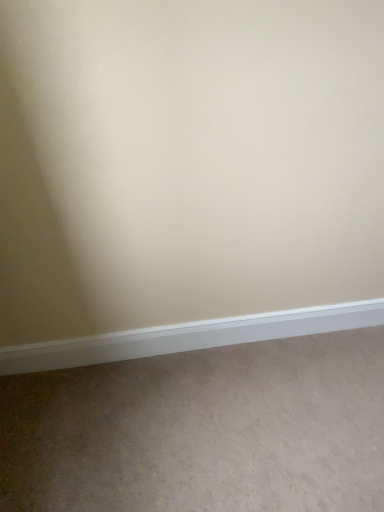
Question: Considering the positions of beige carpet at lower center and white smooth baseboard at lower center in the image, is beige carpet at lower center taller or shorter than white smooth baseboard at lower center?

Choices:
 (A) short
 (B) tall

Answer: (A)

Question: Considering the positions of point (316, 370) and point (29, 356), is point (316, 370) closer or farther from the camera than point (29, 356)?

Choices:
 (A) farther
 (B) closer

Answer: (B)

Question: From a real-world perspective, is beige carpet at lower center above or below white smooth baseboard at lower center?

Choices:
 (A) below
 (B) above

Answer: (A)

Question: Is point (72, 345) closer or farther from the camera than point (190, 440)?

Choices:
 (A) closer
 (B) farther

Answer: (B)

Question: From the image's perspective, relative to beige carpet at lower center, is white smooth baseboard at lower center above or below?

Choices:
 (A) above
 (B) below

Answer: (A)

Question: Based on their positions, is white smooth baseboard at lower center located to the left or right of beige carpet at lower center?

Choices:
 (A) right
 (B) left

Answer: (B)

Question: Which is correct: white smooth baseboard at lower center is inside beige carpet at lower center, or outside of it?

Choices:
 (A) outside
 (B) inside

Answer: (A)